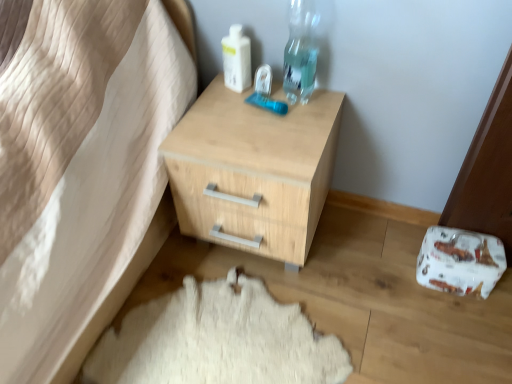
In order to click on free space in front of transparent plastic bottle at upper right in this screenshot , I will do `click(285, 134)`.